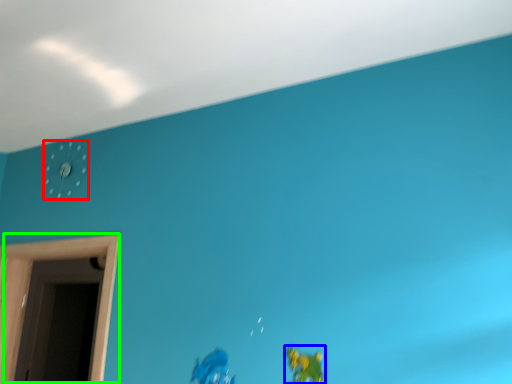
Question: Which object is the farthest from clock (highlighted by a red box)? Choose among these: toy (highlighted by a blue box) or window (highlighted by a green box).

Choices:
 (A) toy
 (B) window

Answer: (A)